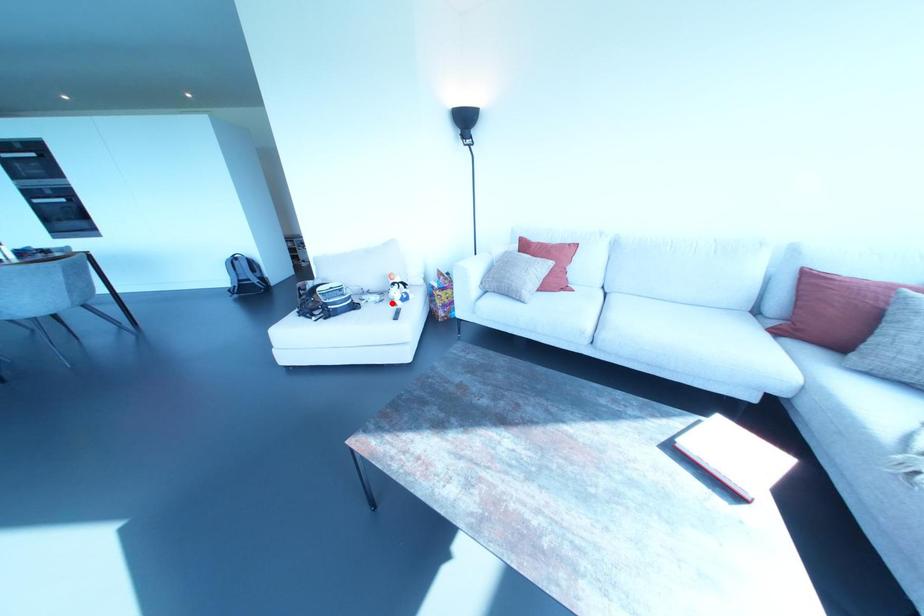
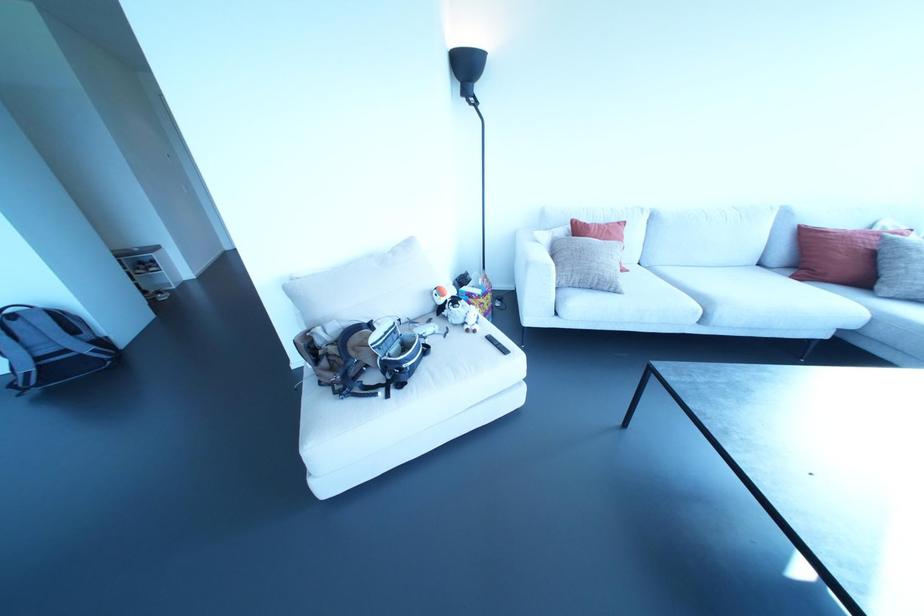
In the second image, find the point that corresponds to the highlighted location in the first image.

(467, 330)